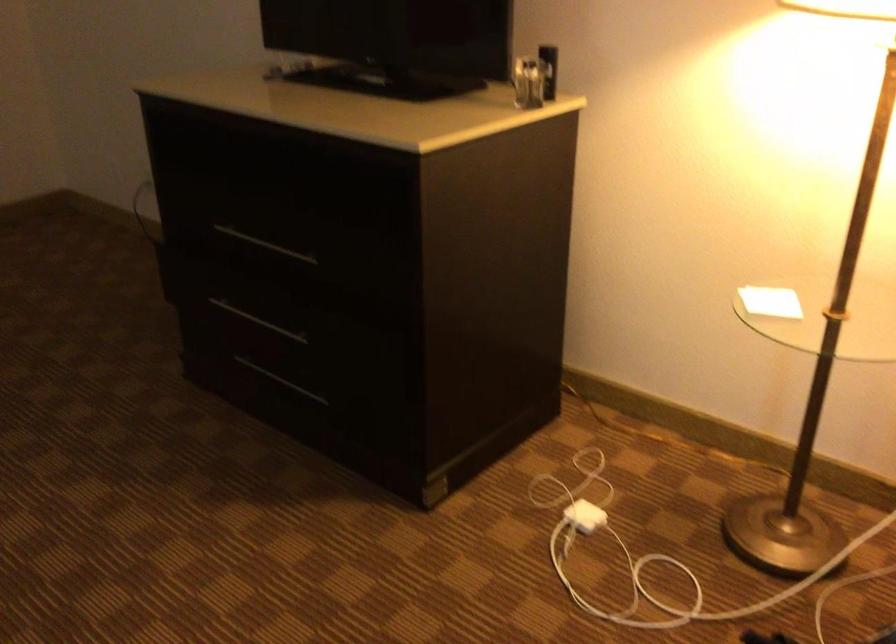
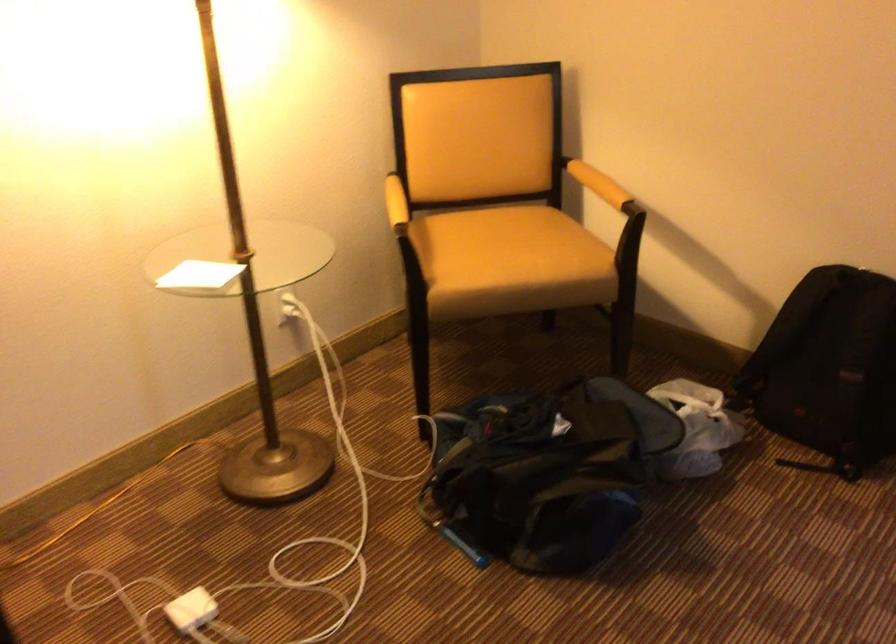
Where in the second image is the point corresponding to point (754, 294) from the first image?

(199, 275)